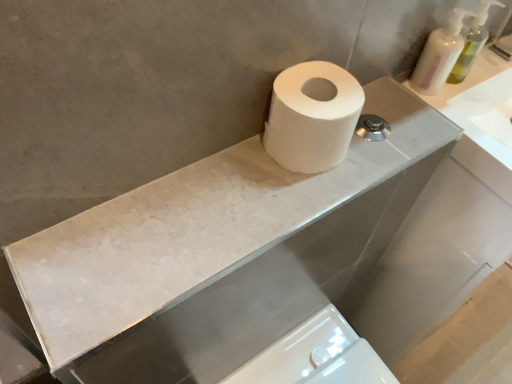
Locate an element on the screen. The width and height of the screenshot is (512, 384). free space to the right of white matte toilet paper at center is located at coordinates (390, 144).